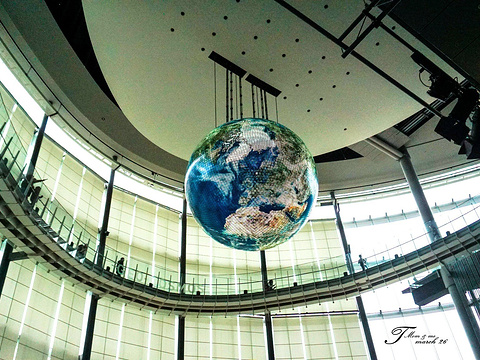
The image size is (480, 360). In order to click on globe in this screenshot , I will do `click(259, 184)`.